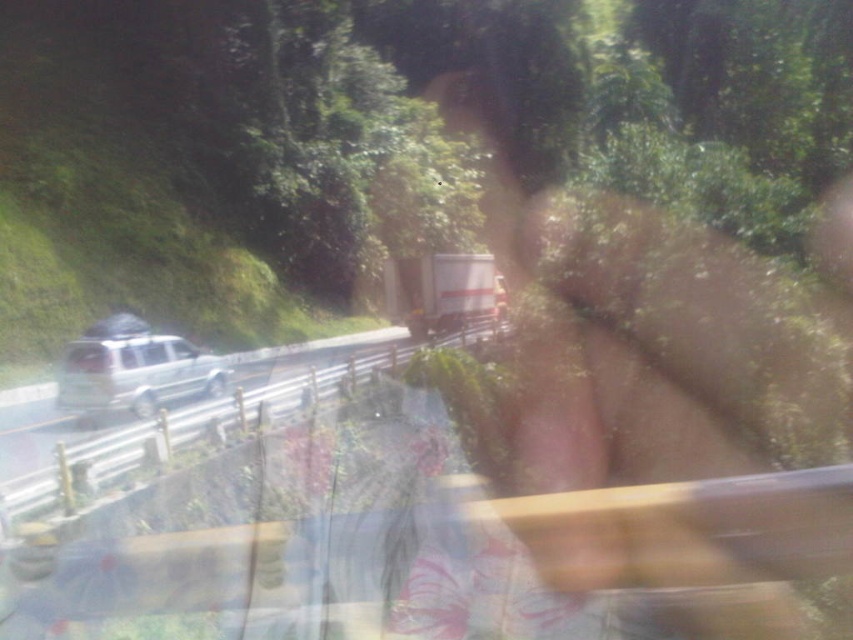
Question: Which point is closer to the camera taking this photo?

Choices:
 (A) (170, 422)
 (B) (131, 364)

Answer: (A)

Question: Observing the image, what is the correct spatial positioning of silver metallic suv at left in reference to satin silver suv at left?

Choices:
 (A) above
 (B) below

Answer: (B)

Question: Which object appears closest to the camera in this image?

Choices:
 (A) satin silver suv at left
 (B) silver metallic suv at left

Answer: (B)

Question: Can you confirm if silver metallic suv at left is thinner than satin silver suv at left?

Choices:
 (A) yes
 (B) no

Answer: (B)

Question: Does silver metallic suv at left come in front of satin silver suv at left?

Choices:
 (A) no
 (B) yes

Answer: (B)